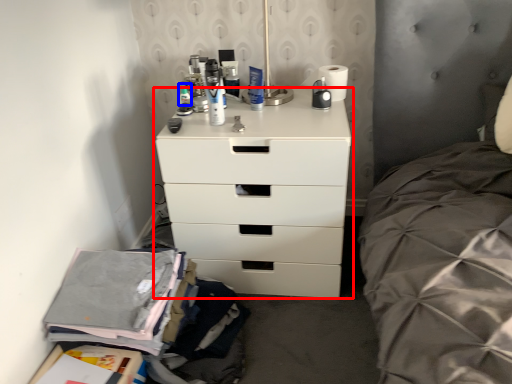
Question: Which object appears farthest to the camera in this image, chest of drawers (highlighted by a red box) or toiletry (highlighted by a blue box)?

Choices:
 (A) chest of drawers
 (B) toiletry

Answer: (B)